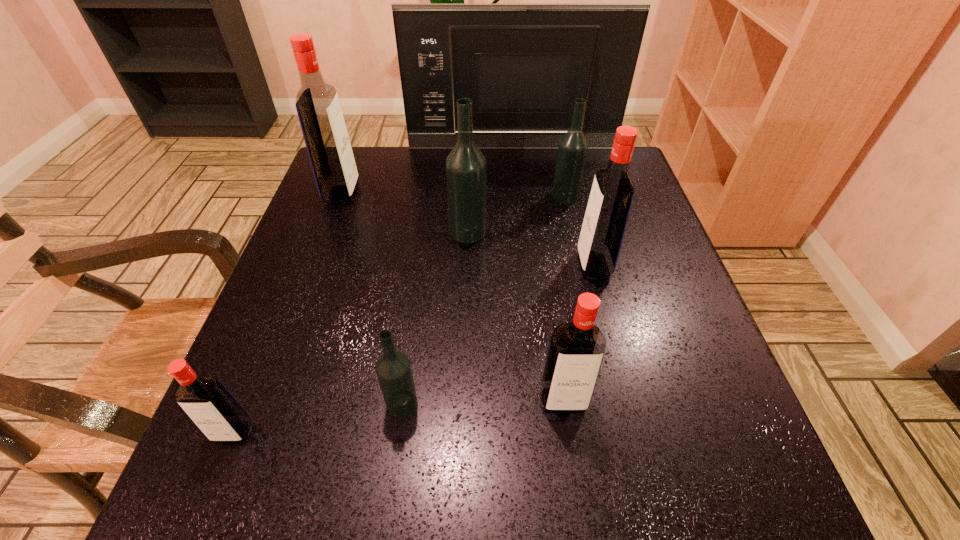
Locate an element on the screen. The height and width of the screenshot is (540, 960). blank region between the fifth nearest vodka and the second farthest red vodka is located at coordinates (531, 248).

Image resolution: width=960 pixels, height=540 pixels. In order to click on vacant area between the biggest red vodka and the microwave oven in this screenshot , I will do `click(427, 171)`.

Locate an element on the screen. vacant point located between the fifth vodka from left to right and the farthest black vodka is located at coordinates (564, 298).

Where is `vacant point located between the rightmost black vodka and the second red vodka from right to left`? The height and width of the screenshot is (540, 960). vacant point located between the rightmost black vodka and the second red vodka from right to left is located at coordinates (564, 298).

Where is `empty space that is in between the smallest red vodka and the tallest vodka`? empty space that is in between the smallest red vodka and the tallest vodka is located at coordinates (288, 313).

Find the location of a particular element. The height and width of the screenshot is (540, 960). empty location between the second nearest black vodka and the farthest red vodka is located at coordinates (405, 213).

Where is `vacant area that lies between the microwave oven and the biggest black vodka`? The width and height of the screenshot is (960, 540). vacant area that lies between the microwave oven and the biggest black vodka is located at coordinates (491, 190).

This screenshot has width=960, height=540. In order to click on object that can be found as the closest to the third red vodka from left to right in this screenshot , I will do `click(393, 368)`.

Point out which object is positioned as the second nearest to the rightmost red vodka. Please provide its 2D coordinates. Your answer should be formatted as a tuple, i.e. [(x, y)], where the tuple contains the x and y coordinates of a point satisfying the conditions above.

[(466, 169)]

This screenshot has width=960, height=540. I want to click on vodka that is the fifth closest one to the rightmost black vodka, so coord(393,368).